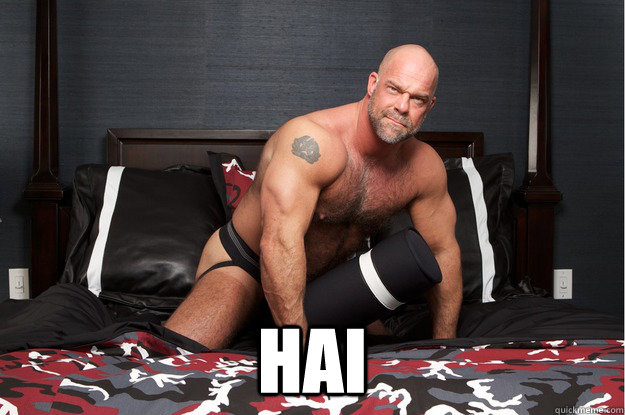
This screenshot has width=625, height=415. What are the coordinates of `camouflage blanket` in the screenshot? It's located at (152, 379).